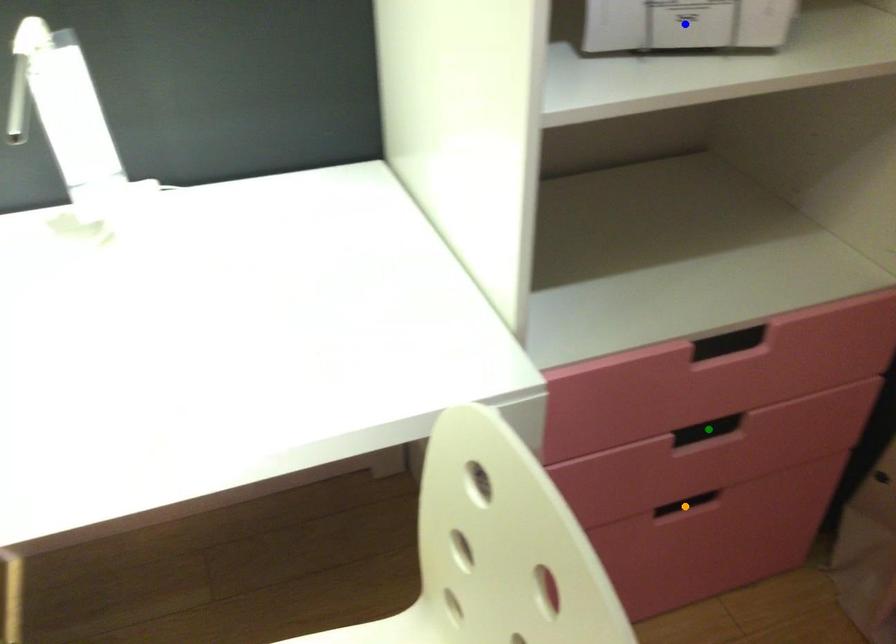
Order these from nearest to farthest:
A) orange point
B) blue point
C) green point

blue point, green point, orange point